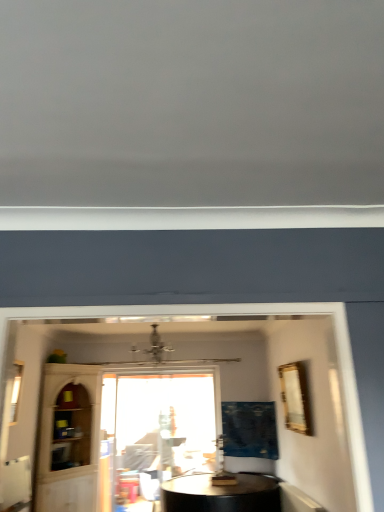
Question: From a real-world perspective, is transparent glass cabinet at lower left under blue fabric curtain at center?

Choices:
 (A) yes
 (B) no

Answer: (A)

Question: Is transparent glass cabinet at lower left oriented away from blue fabric curtain at center?

Choices:
 (A) yes
 (B) no

Answer: (B)

Question: Can you confirm if transparent glass cabinet at lower left is shorter than blue fabric curtain at center?

Choices:
 (A) yes
 (B) no

Answer: (B)

Question: Can you confirm if transparent glass cabinet at lower left is wider than blue fabric curtain at center?

Choices:
 (A) no
 (B) yes

Answer: (A)

Question: Is transparent glass cabinet at lower left positioned before blue fabric curtain at center?

Choices:
 (A) no
 (B) yes

Answer: (B)

Question: Is transparent glass window at center, the second window viewed from the left, situated inside blue fabric curtain at center or outside?

Choices:
 (A) inside
 (B) outside

Answer: (B)

Question: From their relative heights in the image, would you say transparent glass window at center, placed as the first window when sorted from bottom to top, is taller or shorter than blue fabric curtain at center?

Choices:
 (A) tall
 (B) short

Answer: (A)

Question: Is point (102, 509) positioned closer to the camera than point (226, 436)?

Choices:
 (A) closer
 (B) farther

Answer: (A)

Question: Is transparent glass window at center, the second window positioned from the front, to the left or to the right of blue fabric curtain at center in the image?

Choices:
 (A) right
 (B) left

Answer: (B)

Question: Is point (49, 392) positioned closer to the camera than point (117, 429)?

Choices:
 (A) farther
 (B) closer

Answer: (B)

Question: From their relative heights in the image, would you say transparent glass cabinet at lower left is taller or shorter than transparent glass window at center, the second window positioned from the front?

Choices:
 (A) tall
 (B) short

Answer: (A)

Question: Is transparent glass cabinet at lower left spatially inside transparent glass window at center, which appears as the first window when viewed from the right, or outside of it?

Choices:
 (A) outside
 (B) inside

Answer: (A)

Question: Would you say transparent glass cabinet at lower left is to the left or to the right of transparent glass window at center, which appears as the first window when viewed from the right, in the picture?

Choices:
 (A) right
 (B) left

Answer: (B)

Question: Is clear glass window at left, which is the second window in bottom-to-top order, situated inside transparent glass cabinet at lower left or outside?

Choices:
 (A) outside
 (B) inside

Answer: (A)

Question: Based on their sizes in the image, would you say clear glass window at left, which is the first window in left-to-right order, is bigger or smaller than transparent glass cabinet at lower left?

Choices:
 (A) big
 (B) small

Answer: (B)